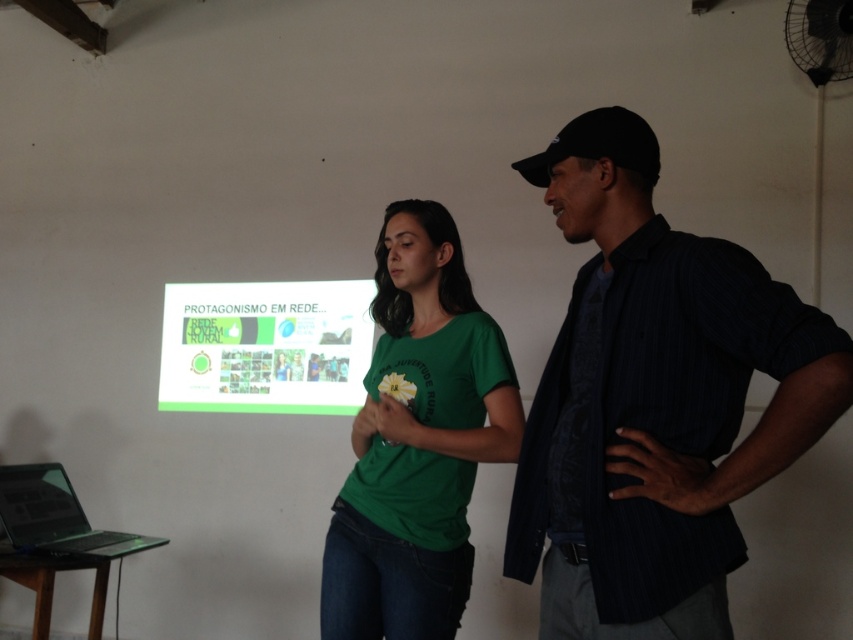
Describe the element at coordinates (654, 400) in the screenshot. I see `dark blue striped shirt at right` at that location.

Which of these two, dark blue striped shirt at right or green matte t-shirt at center, stands taller?

green matte t-shirt at center is taller.

Where is `dark blue striped shirt at right`? This screenshot has width=853, height=640. dark blue striped shirt at right is located at coordinates (654, 400).

Does green matte t-shirt at center have a greater width compared to black glossy laptop at lower left?

In fact, green matte t-shirt at center might be narrower than black glossy laptop at lower left.

Can you confirm if green matte t-shirt at center is positioned to the left of black glossy laptop at lower left?

In fact, green matte t-shirt at center is to the right of black glossy laptop at lower left.

Who is more distant from viewer, [508,458] or [22,532]?

The point [22,532] is behind.

The height and width of the screenshot is (640, 853). What are the coordinates of `green matte t-shirt at center` in the screenshot? It's located at (416, 440).

In the scene shown: Can you confirm if green matte projector screen at center is positioned to the left of black glossy laptop at lower left?

Incorrect, green matte projector screen at center is not on the left side of black glossy laptop at lower left.

Is green matte projector screen at center smaller than black glossy laptop at lower left?

No, green matte projector screen at center is not smaller than black glossy laptop at lower left.

Between point (209, 289) and point (73, 541), which one is positioned in front?

Positioned in front is point (73, 541).

Locate an element on the screen. The width and height of the screenshot is (853, 640). green matte projector screen at center is located at coordinates (265, 346).